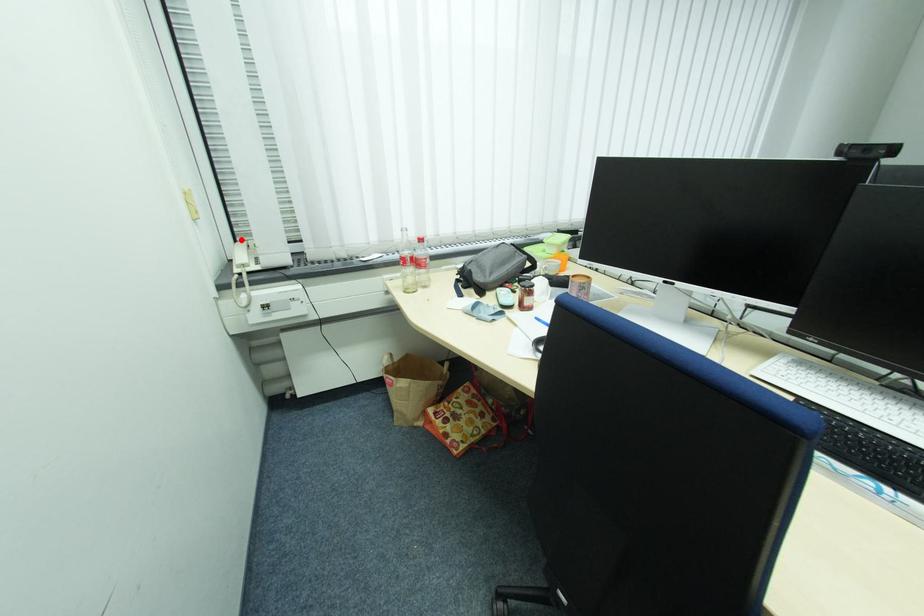
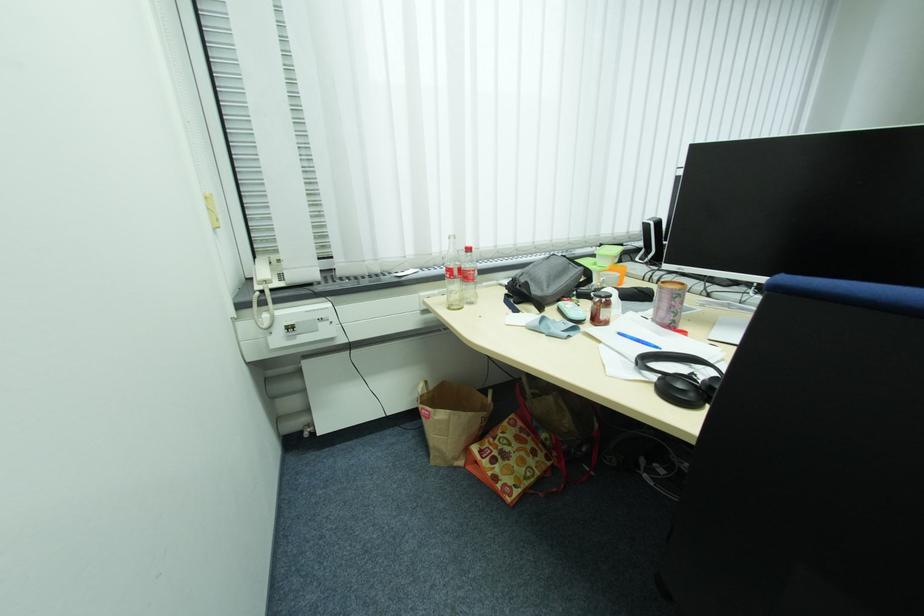
Where in the second image is the point corresponding to the highlighted location from the first image?

(261, 256)